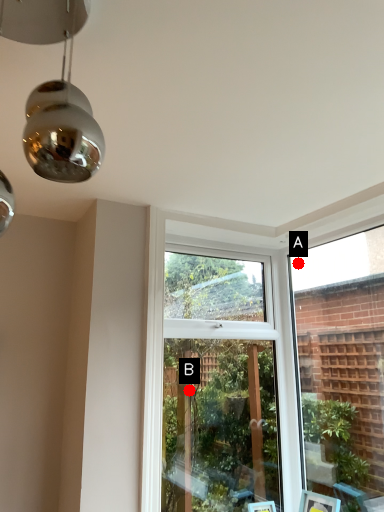
Question: Two points are circled on the image, labeled by A and B beside each circle. Which point is farther to the camera?

Choices:
 (A) A is further
 (B) B is further

Answer: (B)